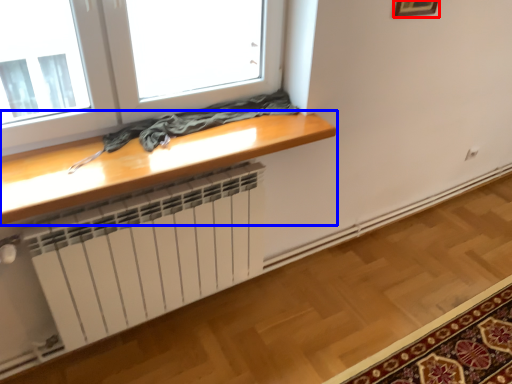
Question: Which of the following is the farthest to the observer, picture frame (highlighted by a red box) or table (highlighted by a blue box)?

Choices:
 (A) picture frame
 (B) table

Answer: (A)